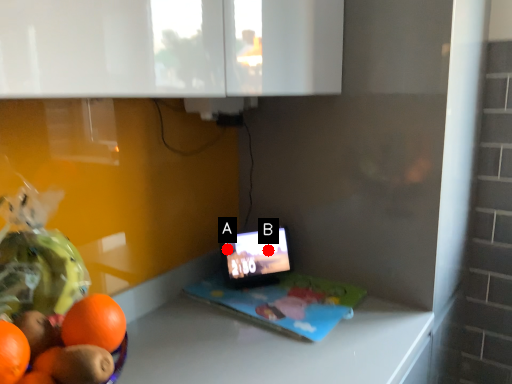
Question: Two points are circled on the image, labeled by A and B beside each circle. Which of the following is the farthest from the observer?

Choices:
 (A) A is further
 (B) B is further

Answer: (B)